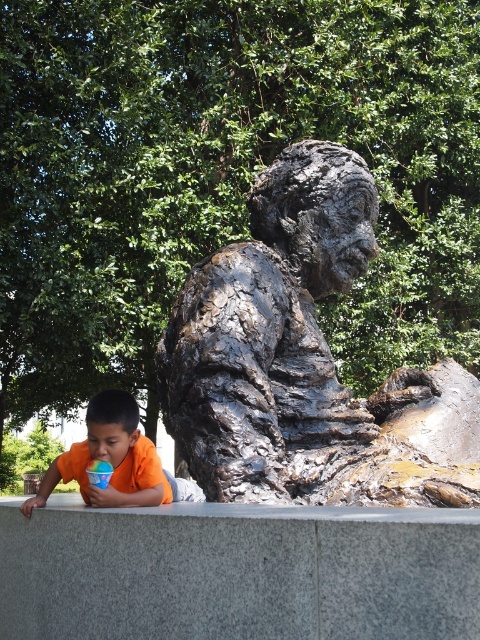
You are standing in the scene and want to place a small decorative statue on the gray granite ledge at center. What are the coordinates where you should place it?

The coordinates for placing the small decorative statue on the gray granite ledge at center are at point (239, 572).

You are a photographer trying to capture the shiny bronze statue at center and the translucent plastic cup at lower left in the same frame. Based on their positions, which object should you adjust your camera angle to focus on first to ensure both are in the shot?

The shiny bronze statue at center is positioned on the right side of the translucent plastic cup at lower left, so you should focus on the translucent plastic cup at lower left first to ensure both are in the frame.